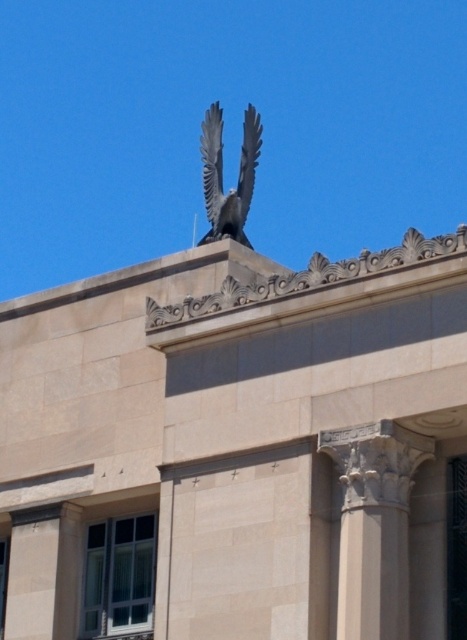
You are standing in front of the building and want to locate the gray stone column at center. Where would you look relative to the eagle sculpture?

The gray stone column at center is located at point (375, 524). Since the eagle sculpture is at the top of the building, the column is positioned below it.

You are an architect assessing the building facade. You notice the gray stone column at center and the polished bronze eagle at upper center. Which object occupies a higher position on the building?

The polished bronze eagle at upper center is taller than the gray stone column at center, so it occupies a higher position on the building.

You are an architect evaluating the building facade. Which object, the gray stone column at center or the polished bronze eagle at upper center, is larger in size?

The polished bronze eagle at upper center is larger in size compared to the gray stone column at center.